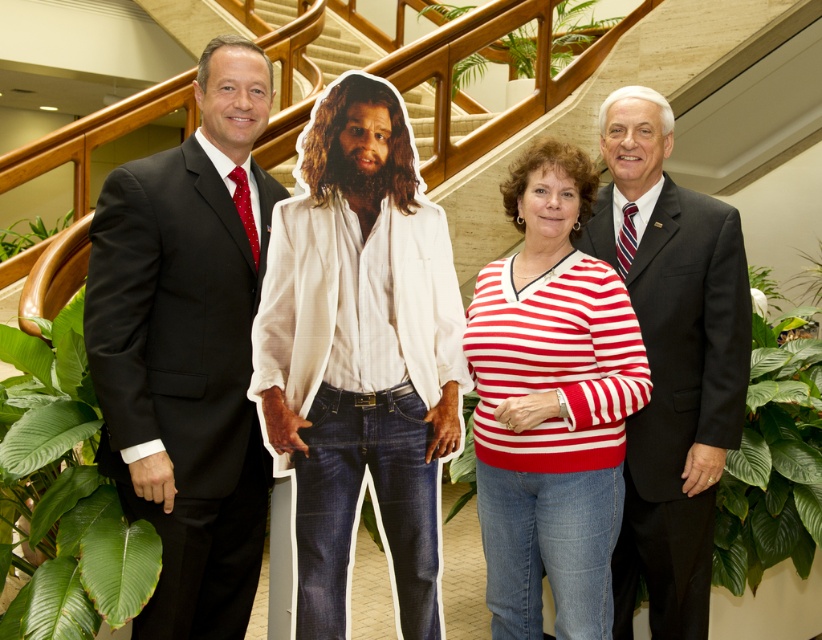
You are an interior designer planning to rearrange the furniture in the room. You want to move the striped knit sweater at center and the green leafy plant at upper center closer to the staircase. Which object should be placed to the left of the other to maintain their original spatial relationship?

The striped knit sweater at center should be placed to the left of the green leafy plant at upper center to maintain their original spatial relationship where the sweater is on the left side of the plant.

You are standing in the same room as the four individuals. The cardboard cutout is placed at point [589,32]. If you want to place a new decorative item exactly 5 meters away from yourself, will it be closer to the cardboard cutout or the staircase?

The cardboard cutout is 6.85 meters away from you. Since you want to place the item 5 meters away, it will be closer to you than the cardboard cutout. However, the question asks whether it is closer to the cardboard cutout or the staircase. Without knowing the distance to the staircase, we cannot determine this. Please provide more information about the staircase location.

You are an event planner arranging a photo shoot in this space. You need to place a tall, narrow stand for a banner that must be positioned between the matte black suit at right and the green leafy plant at lower left. Based on their positions, will the banner stand fit vertically between them without tilting?

The matte black suit at right is above the green leafy plant at lower left, so placing a vertical banner stand between them would require it to be positioned in the space between their vertical positions. Since the banner stand is tall and narrow, it can likely fit vertically between them without tilting as long as there is sufficient horizontal space between their positions.